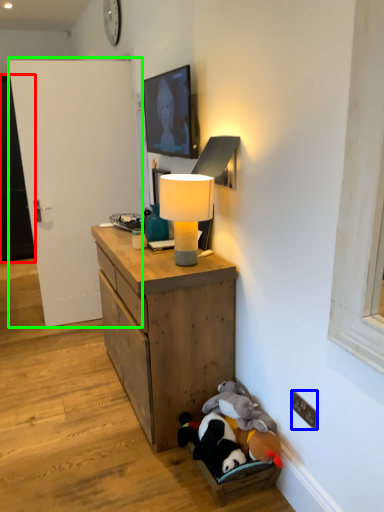
Question: Which object is positioned closest to door (highlighted by a red box)? Select from electric outlet (highlighted by a blue box) and door (highlighted by a green box).

Choices:
 (A) electric outlet
 (B) door

Answer: (B)